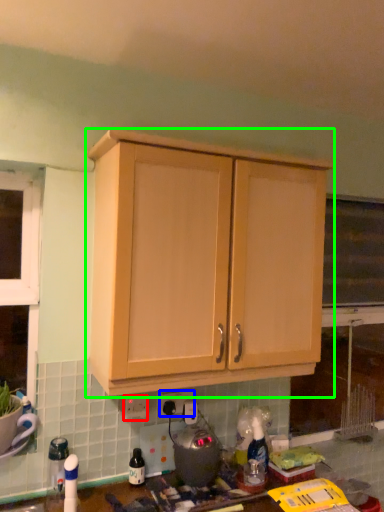
Question: Considering the real-world distances, which object is closest to electric outlet (highlighted by a red box)? electric outlet (highlighted by a blue box) or cabinetry (highlighted by a green box).

Choices:
 (A) electric outlet
 (B) cabinetry

Answer: (A)